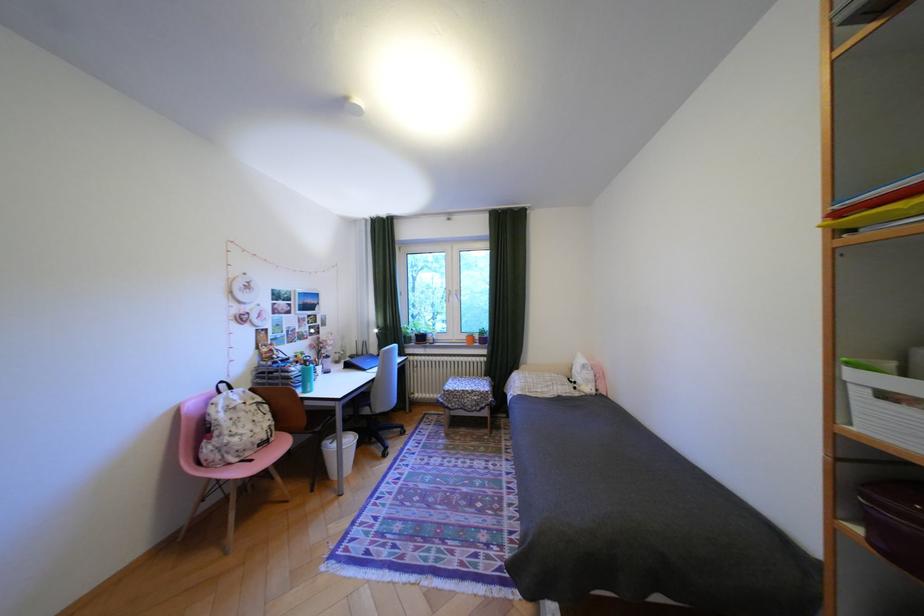
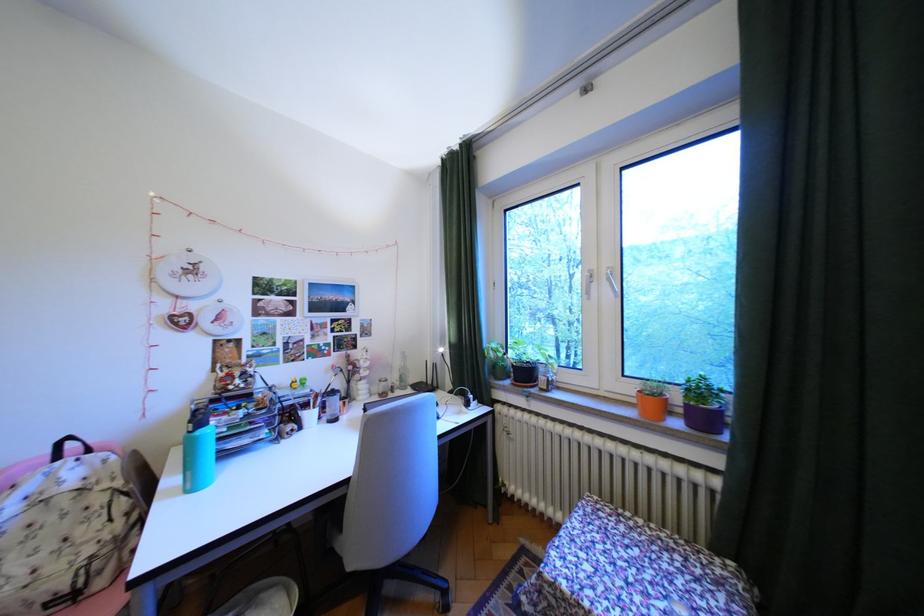
Locate, in the second image, the point that corresponds to the point at 476,337 in the first image.

(641, 390)